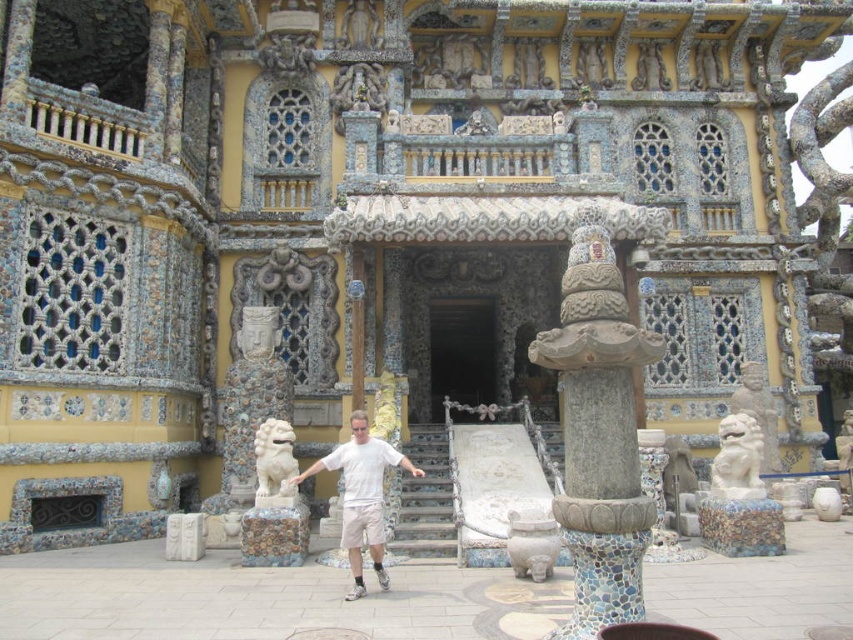
You are an architect examining the temple structure. You notice the white marble lion at right and the smooth stone statue at upper center. Which of these two objects has a greater height?

The white marble lion at right is much taller than the smooth stone statue at upper center.

You are standing in front of the ornate temple or palace structure. You notice a white matte shirt at center and stone stairs at center. Which object takes up more space in the scene?

The white matte shirt at center is bigger than the stone stairs at center, so it takes up more space in the scene.